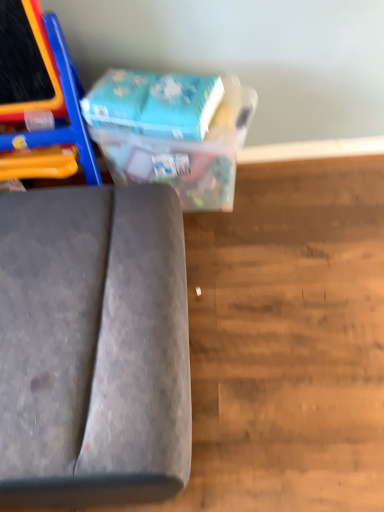
Identify the location of blue cardboard box at upper center. The height and width of the screenshot is (512, 384). (154, 103).

Find the location of a particular element. The width and height of the screenshot is (384, 512). velvet grey sofa at lower left is located at coordinates (40, 98).

I want to click on blue cardboard box at upper center, so click(x=154, y=103).

From the image's perspective, which is below, blue cardboard box at upper center or blue cardboard box at upper center?

blue cardboard box at upper center appears lower in the image.

Based on their positions, is blue cardboard box at upper center located to the left or right of blue cardboard box at upper center?

blue cardboard box at upper center is positioned on blue cardboard box at upper center's left side.

Measure the distance from blue cardboard box at upper center to blue cardboard box at upper center.

A distance of 2.73 inches exists between blue cardboard box at upper center and blue cardboard box at upper center.

Which is behind, point (167, 127) or point (227, 103)?

The point (227, 103) is farther.

From a real-world perspective, is blue cardboard box at upper center physically located above or below velvet grey sofa at lower left?

blue cardboard box at upper center is below velvet grey sofa at lower left.

In the scene shown: Can we say blue cardboard box at upper center lies outside velvet grey sofa at lower left?

blue cardboard box at upper center lies outside velvet grey sofa at lower left's area.

Based on the photo, how many degrees apart are the facing directions of blue cardboard box at upper center and velvet grey sofa at lower left?

The angular difference between blue cardboard box at upper center and velvet grey sofa at lower left is 1.81 degrees.

In the scene shown: Which of these two, blue cardboard box at upper center or velvet grey sofa at lower left, is bigger?

With larger size is velvet grey sofa at lower left.

In the image, is blue cardboard box at upper center positioned in front of or behind blue cardboard box at upper center?

Visually, blue cardboard box at upper center is located behind blue cardboard box at upper center.

Can you confirm if blue cardboard box at upper center is shorter than blue cardboard box at upper center?

No.

From the image's perspective, does blue cardboard box at upper center appear higher than blue cardboard box at upper center?

No, from the image's perspective, blue cardboard box at upper center is not on top of blue cardboard box at upper center.

Is blue cardboard box at upper center oriented towards blue cardboard box at upper center?

No, blue cardboard box at upper center is not turned towards blue cardboard box at upper center.

From the image's perspective, is velvet grey sofa at lower left located above blue cardboard box at upper center?

Correct, velvet grey sofa at lower left appears higher than blue cardboard box at upper center in the image.

What's the angular difference between velvet grey sofa at lower left and blue cardboard box at upper center's facing directions?

velvet grey sofa at lower left and blue cardboard box at upper center are facing 1.81 degrees away from each other.

Would you say blue cardboard box at upper center is part of velvet grey sofa at lower left's contents?

Actually, blue cardboard box at upper center is outside velvet grey sofa at lower left.

Which is more to the left, velvet grey sofa at lower left or blue cardboard box at upper center?

velvet grey sofa at lower left is more to the left.

Considering the sizes of objects velvet grey sofa at lower left and blue cardboard box at upper center in the image provided, who is thinner, velvet grey sofa at lower left or blue cardboard box at upper center?

blue cardboard box at upper center.

Is velvet grey sofa at lower left facing towards blue cardboard box at upper center?

No, velvet grey sofa at lower left is not oriented towards blue cardboard box at upper center.

Is point (23, 69) positioned behind point (114, 82)?

No, (23, 69) is in front of (114, 82).

Is blue cardboard box at upper center facing towards velvet grey sofa at lower left?

No, blue cardboard box at upper center is not oriented towards velvet grey sofa at lower left.

Does point (95, 120) lie behind point (11, 108)?

No, (95, 120) is in front of (11, 108).

Considering the sizes of objects blue cardboard box at upper center and velvet grey sofa at lower left in the image provided, who is taller, blue cardboard box at upper center or velvet grey sofa at lower left?

velvet grey sofa at lower left is taller.

Is blue cardboard box at upper center completely or partially outside of velvet grey sofa at lower left?

Yes.

The width and height of the screenshot is (384, 512). I want to click on paperback book on the left of blue cardboard box at upper center, so click(154, 103).

This screenshot has height=512, width=384. What are the coordinates of `furniture located above the blue cardboard box at upper center (from the image's perspective)` in the screenshot? It's located at (40, 98).

From the image, which object appears to be nearer to velvet grey sofa at lower left, blue cardboard box at upper center or blue cardboard box at upper center?

blue cardboard box at upper center lies closer to velvet grey sofa at lower left than the other object.

Which object lies nearer to the anchor point blue cardboard box at upper center, velvet grey sofa at lower left or blue cardboard box at upper center?

blue cardboard box at upper center is closer to blue cardboard box at upper center.

When comparing their distances from velvet grey sofa at lower left, does blue cardboard box at upper center or blue cardboard box at upper center seem further?

Based on the image, blue cardboard box at upper center appears to be further to velvet grey sofa at lower left.

Based on the photo, based on their spatial positions, is blue cardboard box at upper center or velvet grey sofa at lower left further from blue cardboard box at upper center?

Based on the image, velvet grey sofa at lower left appears to be further to blue cardboard box at upper center.

When comparing their distances from blue cardboard box at upper center, does blue cardboard box at upper center or velvet grey sofa at lower left seem further?

Based on the image, velvet grey sofa at lower left appears to be further to blue cardboard box at upper center.

Based on the photo, estimate the real-world distances between objects in this image. Which object is closer to blue cardboard box at upper center, velvet grey sofa at lower left or blue cardboard box at upper center?

blue cardboard box at upper center lies closer to blue cardboard box at upper center than the other object.

At what (x,y) coordinates should I click in order to perform the action: click on paperback book between velvet grey sofa at lower left and blue cardboard box at upper center. Please return your answer as a coordinate pair (x, y). The image size is (384, 512). Looking at the image, I should click on (154, 103).